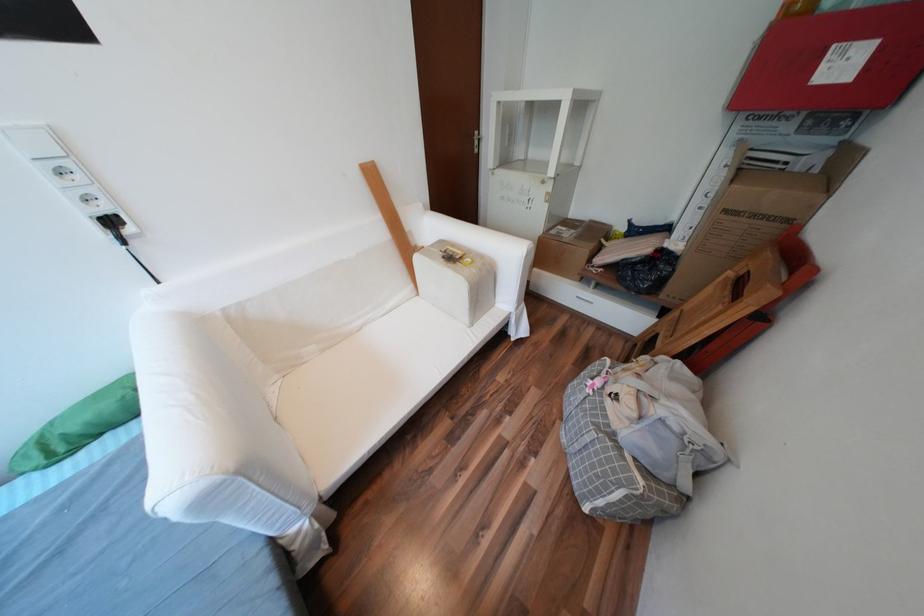
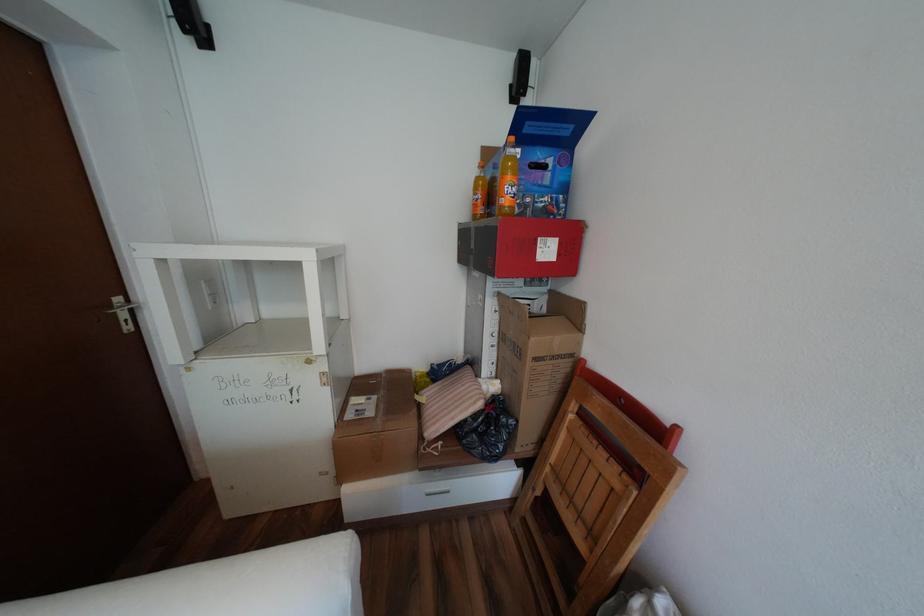
Question: The images are taken continuously from a first-person perspective. In which direction is your viewpoint rotating?

Choices:
 (A) Left
 (B) Right
 (C) Up
 (D) Down

Answer: (B)